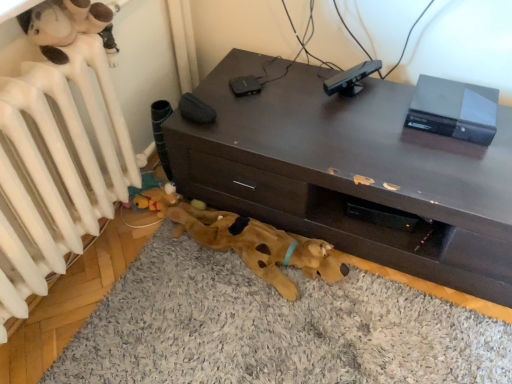
Locate an element on the screen. The height and width of the screenshot is (384, 512). vacant space situated on the left part of black matte sensor at upper center is located at coordinates (301, 90).